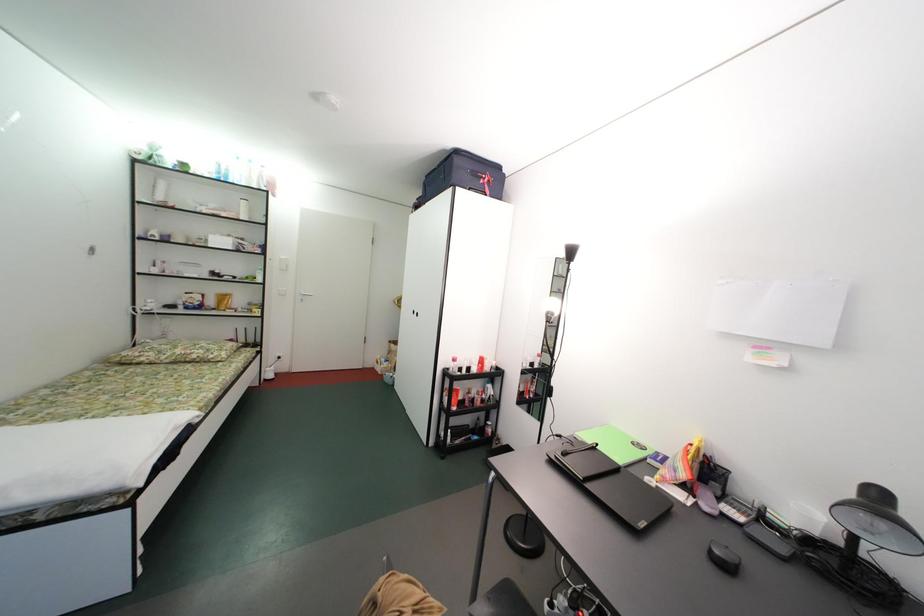
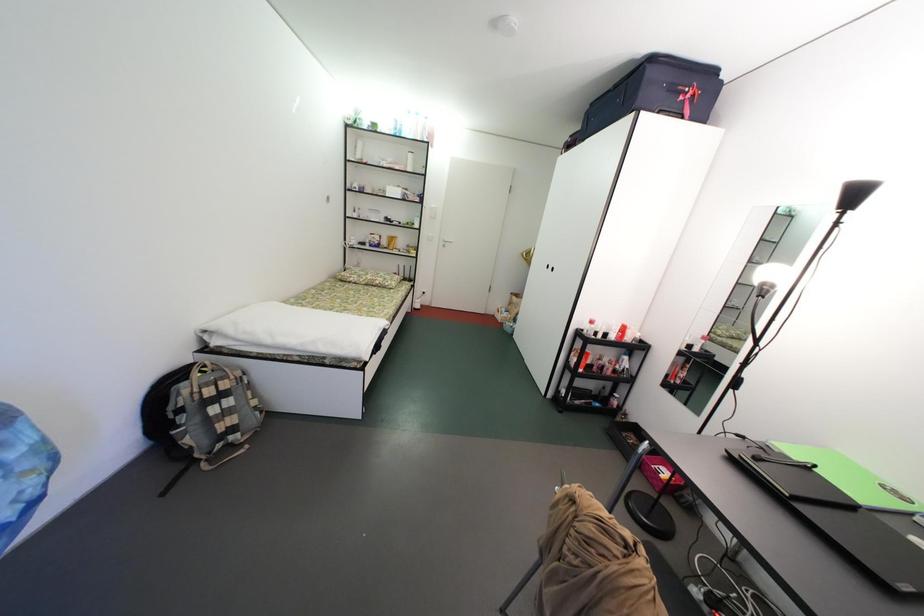
Question: How did the camera likely rotate?

Choices:
 (A) Left
 (B) Right
 (C) Up
 (D) Down

Answer: (A)